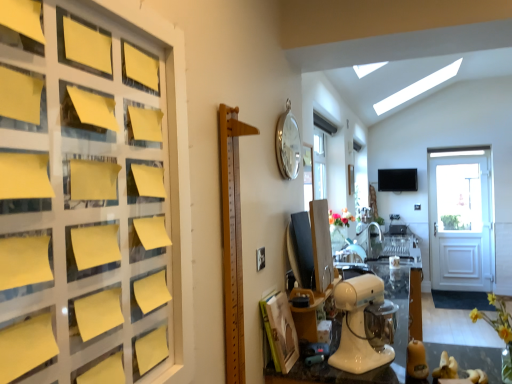
Question: Can you confirm if yellow paper at left is shorter than floral bouquet at center, the 2th flower ordered from the bottom?

Choices:
 (A) no
 (B) yes

Answer: (A)

Question: Considering the relative positions of yellow paper at left and floral bouquet at center, marked as the 1th flower in a back-to-front arrangement, in the image provided, is yellow paper at left to the left of floral bouquet at center, marked as the 1th flower in a back-to-front arrangement, from the viewer's perspective?

Choices:
 (A) yes
 (B) no

Answer: (A)

Question: Is floral bouquet at center, marked as the 1th flower in a back-to-front arrangement, at the back of yellow paper at left?

Choices:
 (A) yes
 (B) no

Answer: (B)

Question: Does yellow paper at left have a greater height compared to floral bouquet at center, marked as the 1th flower in a back-to-front arrangement?

Choices:
 (A) no
 (B) yes

Answer: (B)

Question: Can you confirm if yellow paper at left is wider than floral bouquet at center, acting as the 2th flower starting from the front?

Choices:
 (A) yes
 (B) no

Answer: (B)

Question: Is yellow paper at left to the left or to the right of yellow matte flower at lower right, which appears as the 2th flower when viewed from the back, in the image?

Choices:
 (A) left
 (B) right

Answer: (A)

Question: Is yellow paper at left in front of or behind yellow matte flower at lower right, marked as the first flower in a bottom-to-top arrangement, in the image?

Choices:
 (A) behind
 (B) front

Answer: (B)

Question: Is yellow paper at left wider or thinner than yellow matte flower at lower right, which appears as the 2th flower when viewed from the back?

Choices:
 (A) wide
 (B) thin

Answer: (B)

Question: Would you say yellow paper at left is inside or outside yellow matte flower at lower right, the first flower viewed from the front?

Choices:
 (A) outside
 (B) inside

Answer: (A)

Question: Visually, is wooden ruler at center positioned to the left or to the right of yellow matte flower at lower right, the first flower viewed from the front?

Choices:
 (A) left
 (B) right

Answer: (A)

Question: Is point (227, 292) closer or farther from the camera than point (472, 309)?

Choices:
 (A) farther
 (B) closer

Answer: (B)

Question: From their relative heights in the image, would you say wooden ruler at center is taller or shorter than yellow matte flower at lower right, marked as the first flower in a bottom-to-top arrangement?

Choices:
 (A) tall
 (B) short

Answer: (A)

Question: Is wooden ruler at center inside the boundaries of yellow matte flower at lower right, which appears as the 2th flower when viewed from the back, or outside?

Choices:
 (A) inside
 (B) outside

Answer: (B)

Question: From a real-world perspective, is transparent glass table at lower right positioned above or below wooden ruler at center?

Choices:
 (A) below
 (B) above

Answer: (A)

Question: In terms of width, does transparent glass table at lower right look wider or thinner when compared to wooden ruler at center?

Choices:
 (A) thin
 (B) wide

Answer: (B)